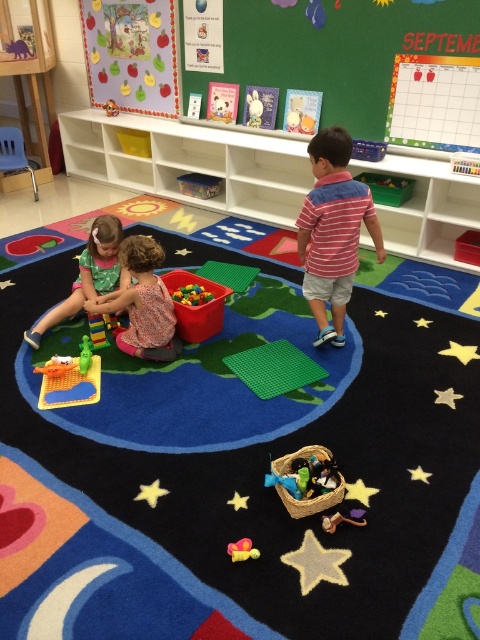
Question: Is green fabric dress at lower left wider than white plush rabbit at upper center?

Choices:
 (A) yes
 (B) no

Answer: (A)

Question: Can you confirm if white plush rabbit at upper center is positioned to the right of rubber duck at lower center?

Choices:
 (A) no
 (B) yes

Answer: (B)

Question: Which of the following is the farthest from the observer?

Choices:
 (A) rubber duck at lower center
 (B) green fabric dress at lower left
 (C) white plush rabbit at upper center
 (D) striped cotton shirt at center

Answer: (C)

Question: Which object is closer to the camera taking this photo?

Choices:
 (A) rubberized plastic toy at lower center
 (B) green plastic toy at lower left
 (C) rubber duck at lower center

Answer: (C)

Question: Is wooden toy basket at lower center wider than rubber duck at lower center?

Choices:
 (A) yes
 (B) no

Answer: (A)

Question: Among these points, which one is nearest to the camera?

Choices:
 (A) (330, 518)
 (B) (443, 61)
 (C) (301, 513)

Answer: (A)